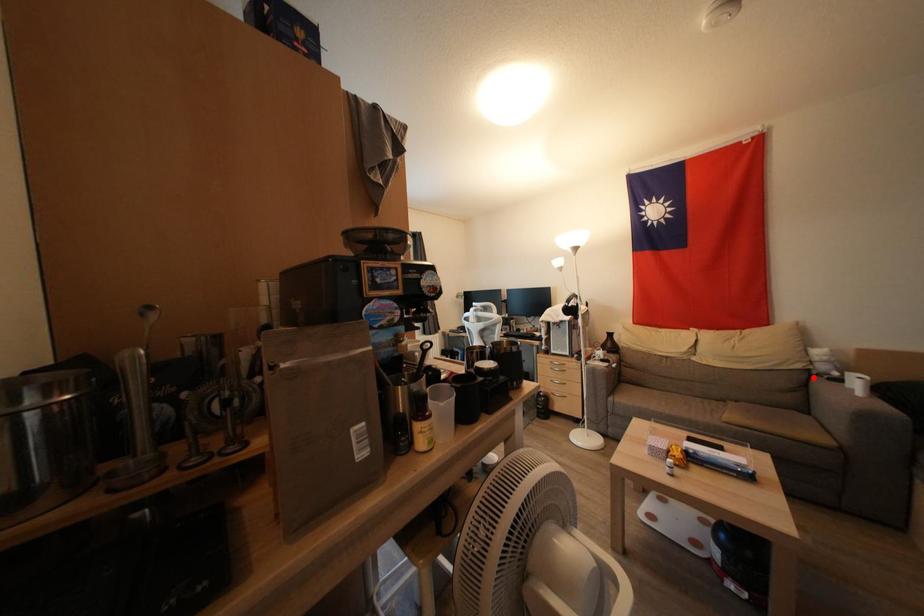
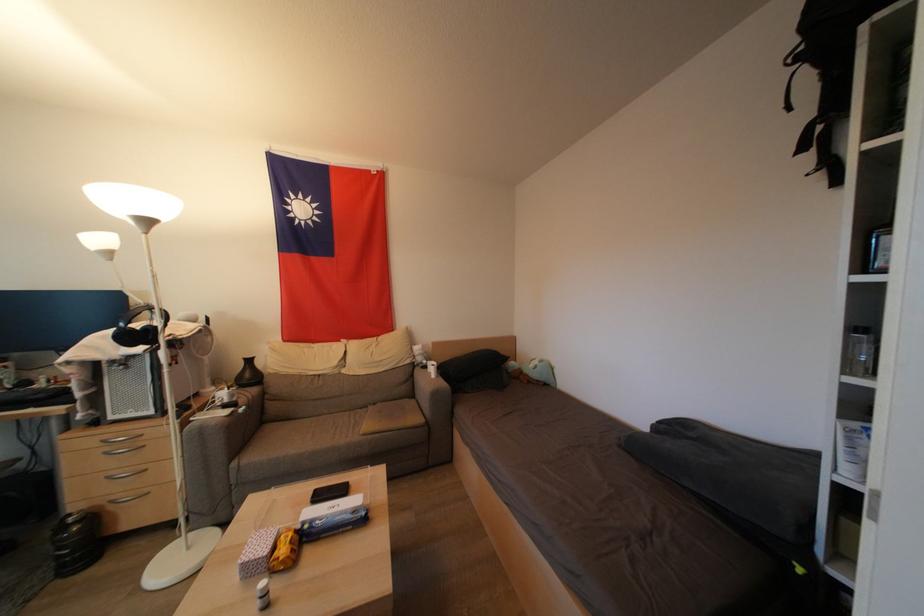
In the second image, find the point that corresponds to the highlighted location in the first image.

(418, 370)